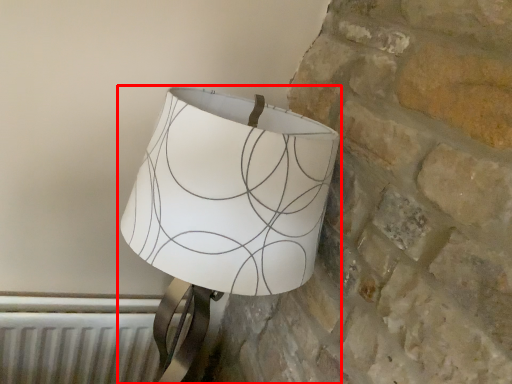
Question: In this image, where is lamp (annotated by the red box) located relative to radiator?

Choices:
 (A) right
 (B) left

Answer: (A)